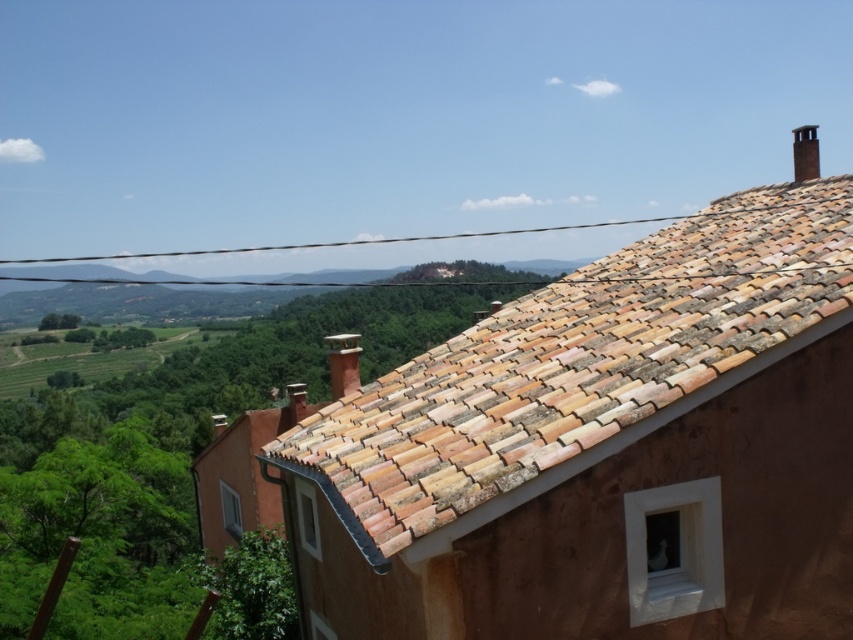
Is point (552, 400) positioned in front of point (795, 129)?

Yes.

Is point (836, 264) positioned after point (809, 141)?

No.

Where is `terracotta tiles at upper right`? The height and width of the screenshot is (640, 853). terracotta tiles at upper right is located at coordinates (577, 369).